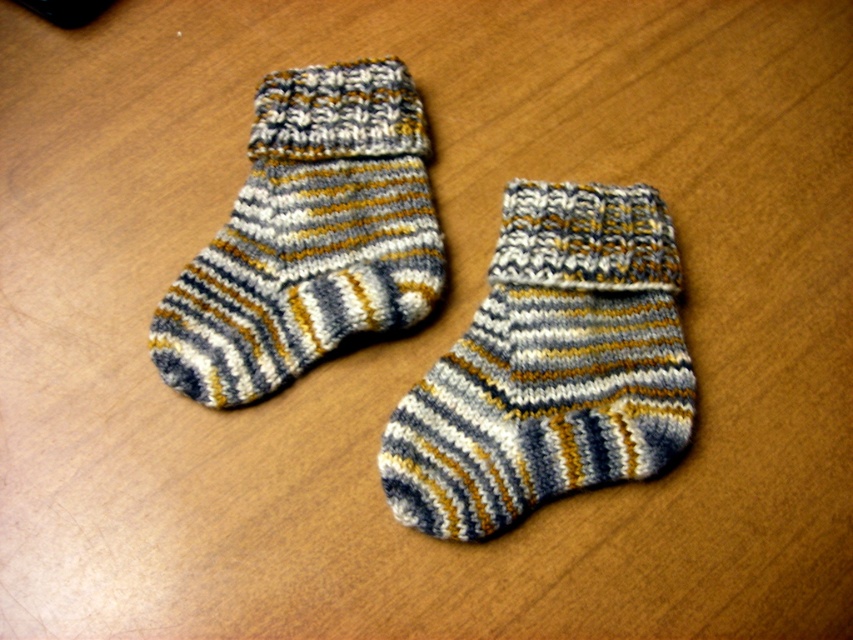
Please provide the coordinates of the striped woolen sock at center in the image. The coordinate system is normalized, with the origin at the bottom left corner of the image. The x and y axes are both in the range of 0 to 1. The coordinates are represented as a tuple of two decimal numbers, rounded to three decimal places. Please answer with only the coordinates in the format of the tuple, without any explanation or extra text.

The coordinates of the striped woolen sock at center are at point (549, 365).

In the scene shown: You are taking a photo of the socks and want to focus on the point closer to the camera. Which point should you choose between point (442,534) and point (416,301)?

Point (442,534) is closer to the camera than point (416,301), so you should choose point (442,534) to focus on.

In the scene shown: You are organizing a sock drawer and need to place the striped woolen sock at center and the striped woolen sock at upper left. Since the drawer has limited space, which sock should you place first to ensure both fit properly?

The striped woolen sock at center is positioned under the striped woolen sock at upper left, so you should place the striped woolen sock at upper left first in the drawer to accommodate the layered arrangement.